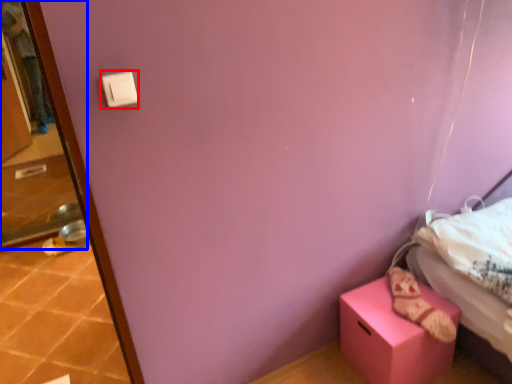
Question: Which point is closer to the camera, light switch (highlighted by a red box) or screen door (highlighted by a blue box)?

Choices:
 (A) light switch
 (B) screen door

Answer: (A)